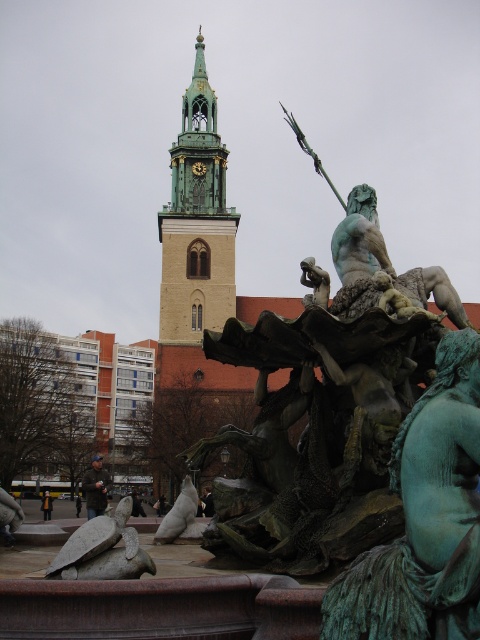
Question: Which object is the farthest from the bronze statue at center?

Choices:
 (A) green patina statue at center
 (B) bronze statue at lower left
 (C) green copper bell tower at upper center

Answer: (C)

Question: Considering the real-world distances, which object is farthest from the green patina statue at center?

Choices:
 (A) bronze statue at lower left
 (B) bronze statue at center

Answer: (B)

Question: Does green copper bell tower at upper center appear over bronze statue at lower left?

Choices:
 (A) yes
 (B) no

Answer: (A)

Question: Where is green copper bell tower at upper center located in relation to bronze statue at lower left in the image?

Choices:
 (A) below
 (B) above

Answer: (B)

Question: Is the position of green patina statue at center less distant than that of bronze statue at center?

Choices:
 (A) no
 (B) yes

Answer: (B)

Question: Which of the following is the closest to the observer?

Choices:
 (A) (220, 202)
 (B) (155, 540)

Answer: (B)